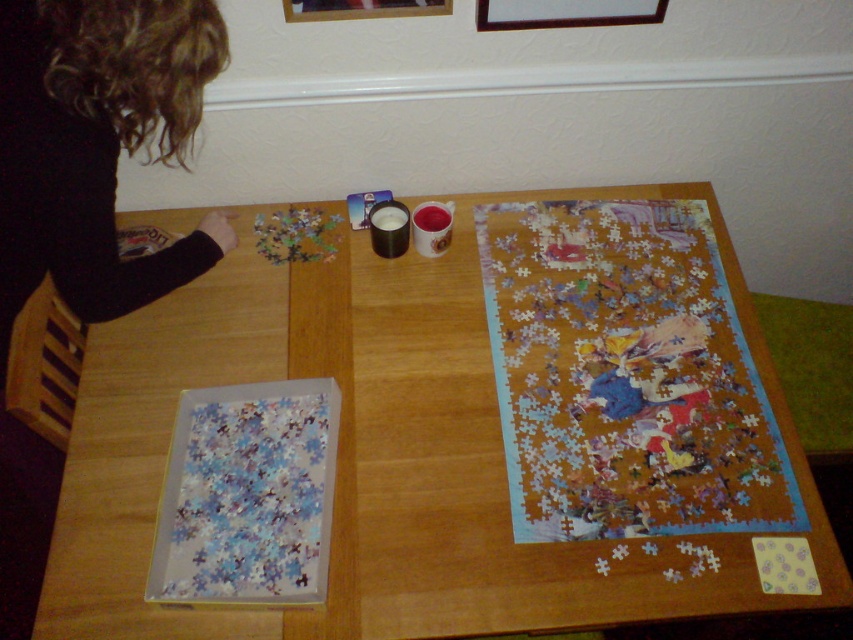
Question: Which is nearer to the wooden table at center?

Choices:
 (A) wooden picture frame at upper center
 (B) multicolored paper puzzle at right
 (C) brushed metal picture frame at upper center

Answer: (B)

Question: Which of the following is the farthest from the observer?

Choices:
 (A) [167, 131]
 (B) [596, 616]

Answer: (A)

Question: Which of the following is the farthest from the observer?

Choices:
 (A) (633, 292)
 (B) (286, 3)
 (C) (126, 74)
 (D) (277, 365)

Answer: (A)

Question: In this image, where is multicolored paper puzzle at right located relative to curly hair at upper left?

Choices:
 (A) right
 (B) left

Answer: (A)

Question: Does multicolored paper puzzle at right have a larger size compared to wooden picture frame at upper center?

Choices:
 (A) no
 (B) yes

Answer: (B)

Question: Observing the image, what is the correct spatial positioning of multicolored paper puzzle at right in reference to curly hair at upper left?

Choices:
 (A) right
 (B) left

Answer: (A)